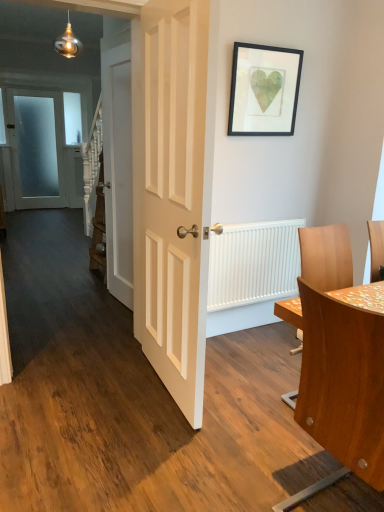
Identify the location of free location to the left of white glossy door at center, the first door when ordered from front to back. (93, 389).